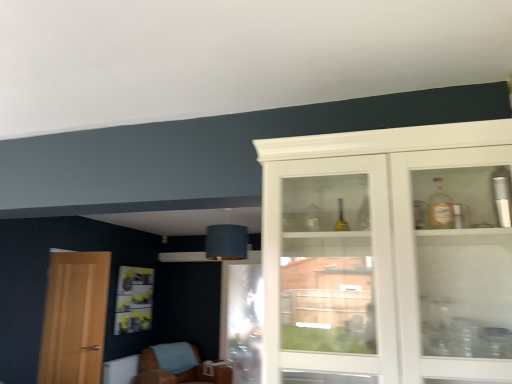
Question: Looking at their shapes, would you say white glass cabinet at right is wider or thinner than brown leather chair at lower left?

Choices:
 (A) thin
 (B) wide

Answer: (A)

Question: Considering their positions, is white glass cabinet at right located in front of or behind brown leather chair at lower left?

Choices:
 (A) front
 (B) behind

Answer: (A)

Question: Which of these objects is positioned closest to the white glass cabinet at right?

Choices:
 (A) transparent glass screen door at lower center
 (B) brown leather chair at lower left
 (C) light brown wooden door at left

Answer: (A)

Question: Which is farther from the white glass cabinet at right?

Choices:
 (A) light brown wooden door at left
 (B) brown leather chair at lower left
 (C) transparent glass screen door at lower center

Answer: (B)